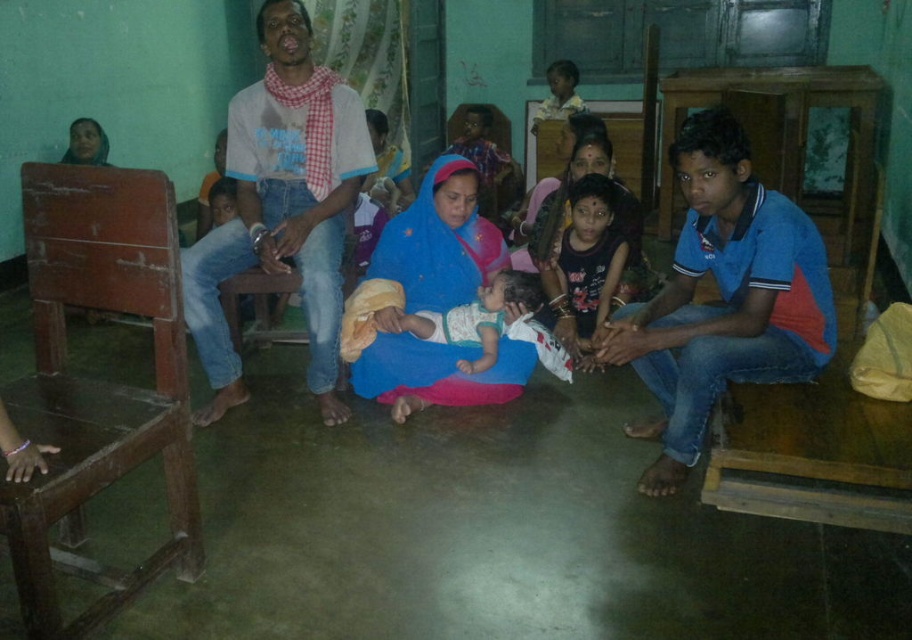
You are an interior designer planning to place a new painting on the wall in the room. The painting is 0.5 meters wide and needs to be placed exactly at the coordinates where the blue cotton shirt at right is located. Is there enough space on the wall to accommodate the painting without overlapping any existing objects?

The blue cotton shirt at right is positioned at point (723, 298). Since the painting is 0.5 meters wide and the coordinates indicate its placement, there should be sufficient space on the wall as long as no other objects are present at those coordinates. However, the description does not mention any overlapping objects, so it should fit.

You are organizing a clothing donation drive and need to determine which item takes up more space in the donation box. Based on the image, which item is larger in size between the blue cotton shirt at right and the dark blue fabric dress at center?

The blue cotton shirt at right is larger in size than the dark blue fabric dress at center, so it takes up more space in the donation box.